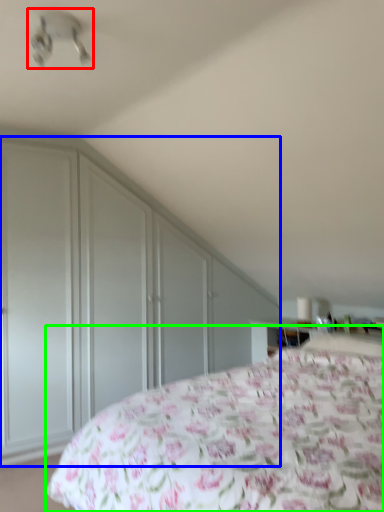
Question: Which object is the farthest from fan (highlighted by a red box)? Choose among these: dresser (highlighted by a blue box) or bed (highlighted by a green box).

Choices:
 (A) dresser
 (B) bed

Answer: (B)